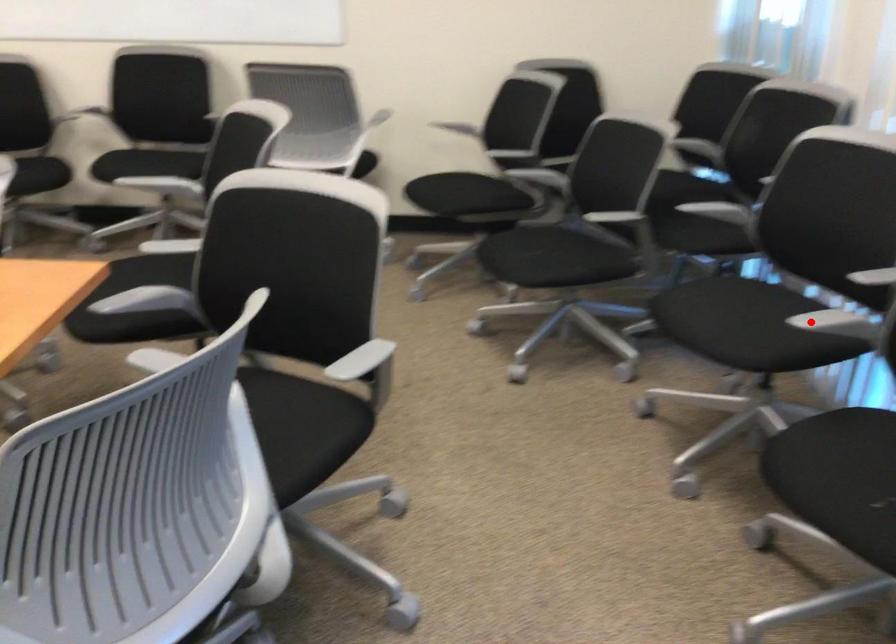
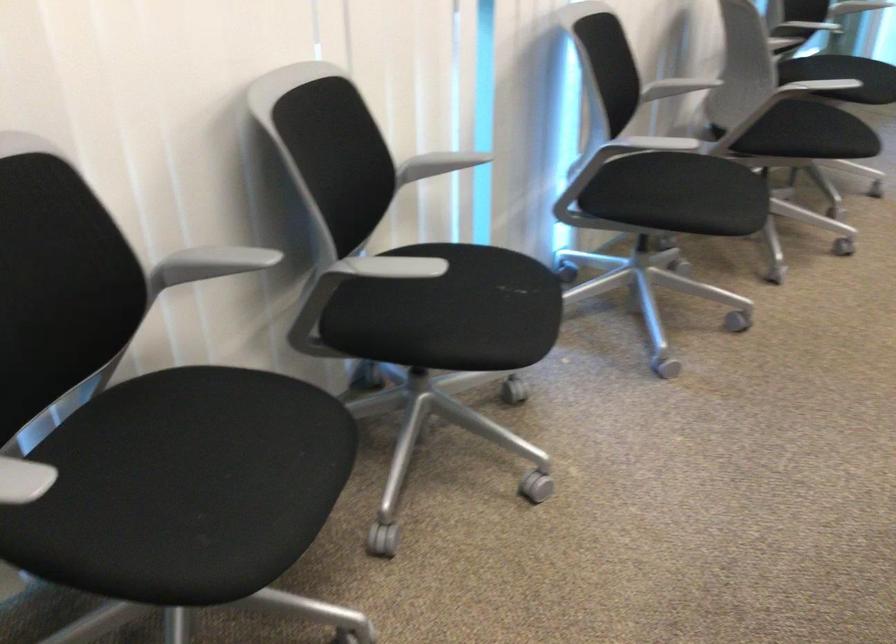
In the second image, find the point that corresponds to the highlighted location in the first image.

(384, 267)